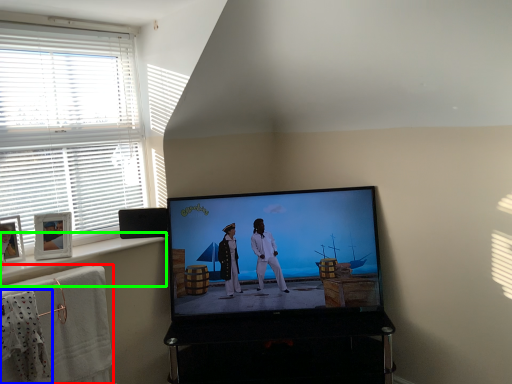
Question: Which object is the farthest from bath towel (highlighted by a red box)? Choose among these: laundry (highlighted by a blue box) or window sill (highlighted by a green box).

Choices:
 (A) laundry
 (B) window sill

Answer: (B)